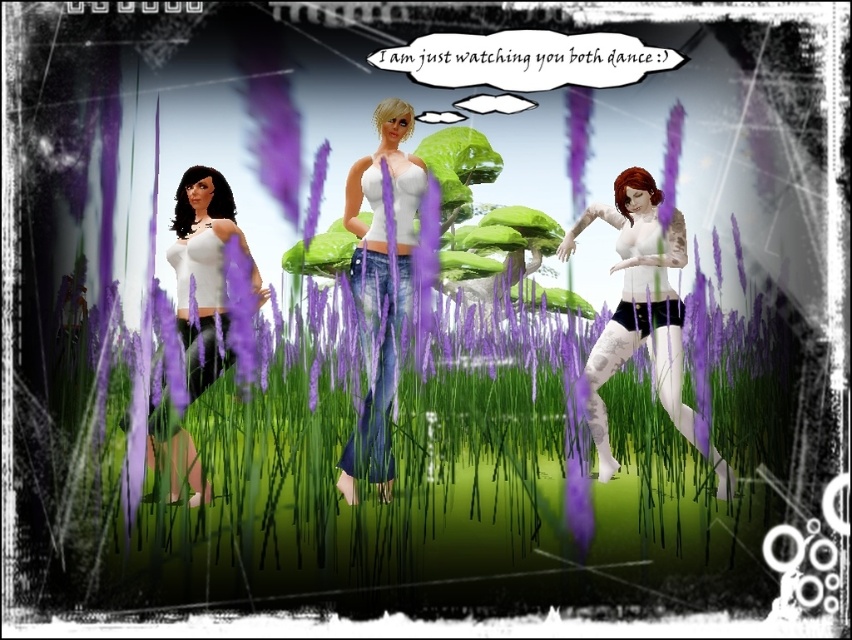
You are a character in the image and want to step onto the purple grass at center without touching the white matte leggings at center. Is this possible?

The purple grass at center is larger in size than the white matte leggings at center, so yes, you can step onto the purple grass at center without touching the white matte leggings at center because there is enough space between them.

Based on the scene description, which object is shorter between the white matte leggings at center and the white matte tank top at center?

The white matte leggings at center is shorter than the white matte tank top at center.

You are a fashion designer trying to create a cohesive outfit. You have two items in front of you, the white matte leggings at center and the white matte tank top at center. Given their positions, will they be able to be worn together comfortably without any adjustments?

The white matte leggings at center and white matte tank top at center are 5.51 feet apart, which is a significant distance between them. This suggests they are not positioned to be worn together as part of the same outfit, so adjustments would be necessary to coordinate them properly.